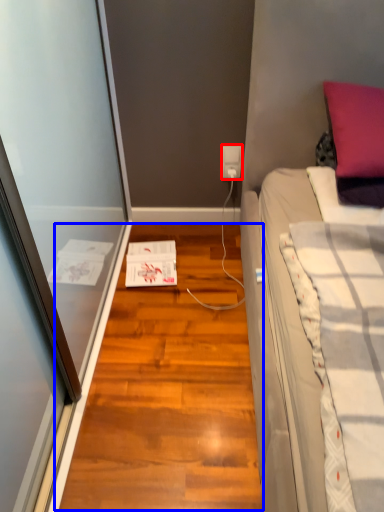
Question: Among these objects, which one is farthest to the camera, power outlet (highlighted by a red box) or hardwood (highlighted by a blue box)?

Choices:
 (A) power outlet
 (B) hardwood

Answer: (A)